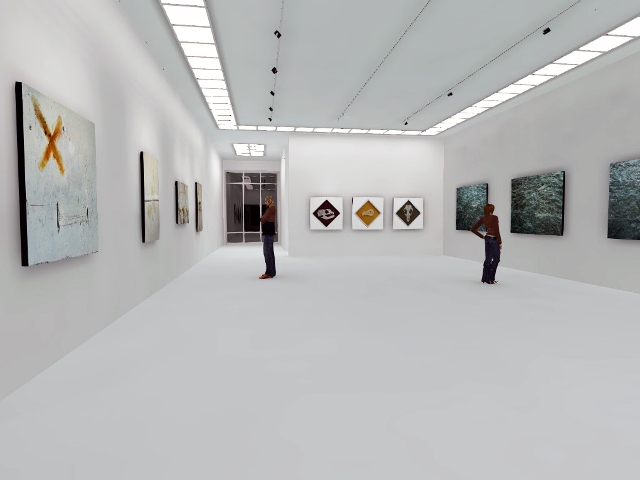
Locate an element on the screen. This screenshot has height=480, width=640. lights is located at coordinates (185, 8), (191, 32), (200, 60), (212, 88), (221, 116), (240, 146), (253, 145).